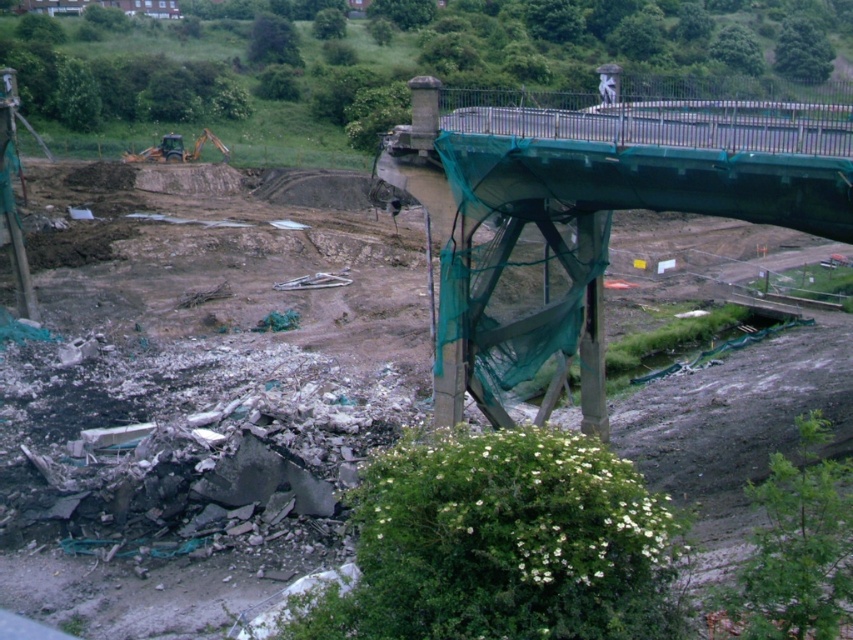
How far apart are green fabric-covered bridge at upper right and green rubber excavator at left?

40.33 meters

Which is behind, point (445, 240) or point (219, 140)?

The point (219, 140) is more distant.

Does point (544, 180) come closer to viewer compared to point (155, 160)?

Yes, point (544, 180) is in front of point (155, 160).

Where is `green fabric-covered bridge at upper right`? This screenshot has width=853, height=640. green fabric-covered bridge at upper right is located at coordinates (587, 214).